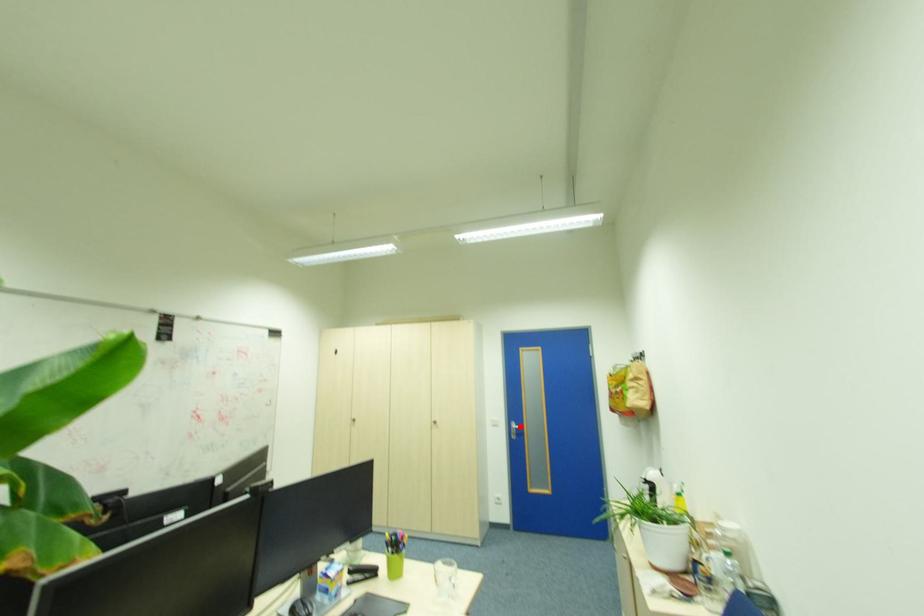
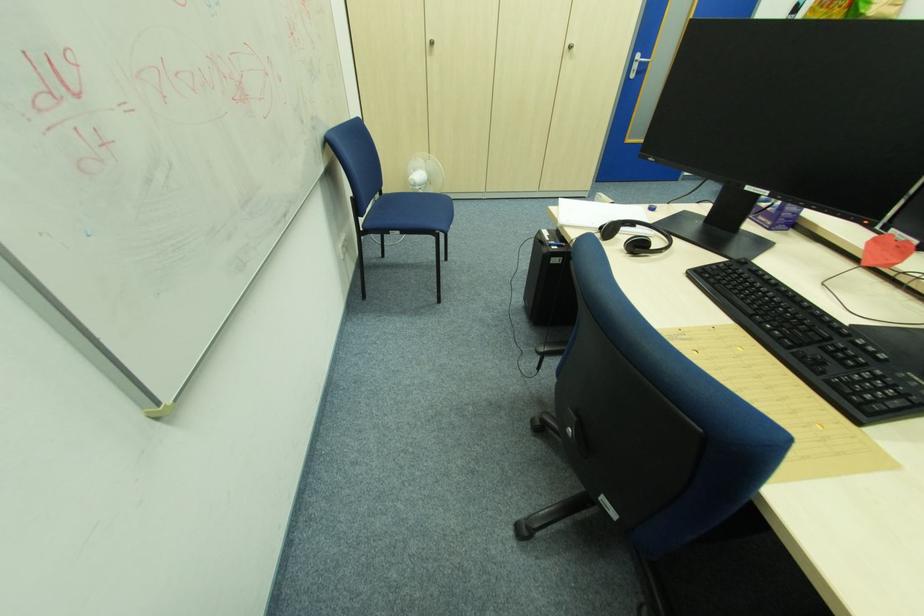
Locate, in the second image, the point that corresponds to the highlighted location in the first image.

(647, 61)